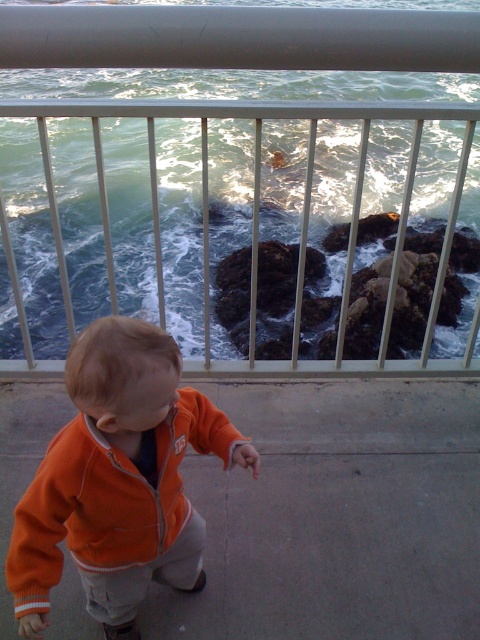
Question: Can you confirm if metallic silver railing at upper center is wider than orange fleece jacket at lower left?

Choices:
 (A) yes
 (B) no

Answer: (A)

Question: Can you confirm if metallic silver railing at upper center is positioned below orange fleece jacket at lower left?

Choices:
 (A) no
 (B) yes

Answer: (A)

Question: Which of the following is the closest to the observer?

Choices:
 (A) metallic silver railing at upper center
 (B) orange fleece jacket at lower left

Answer: (B)

Question: Which point appears closest to the camera in this image?

Choices:
 (A) (86, 608)
 (B) (69, 294)

Answer: (A)

Question: Is metallic silver railing at upper center above orange fleece jacket at lower left?

Choices:
 (A) yes
 (B) no

Answer: (A)